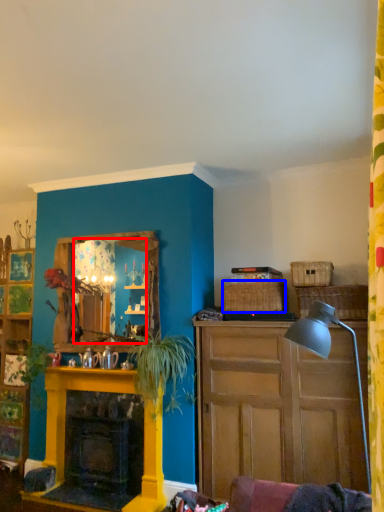
Question: Which object appears farthest to the camera in this image, mirror (highlighted by a red box) or picnic basket (highlighted by a blue box)?

Choices:
 (A) mirror
 (B) picnic basket

Answer: (A)